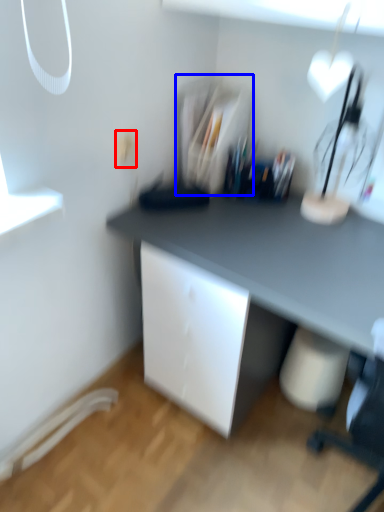
Question: Which object is further to the camera taking this photo, electric outlet (highlighted by a red box) or shelf (highlighted by a blue box)?

Choices:
 (A) electric outlet
 (B) shelf

Answer: (B)